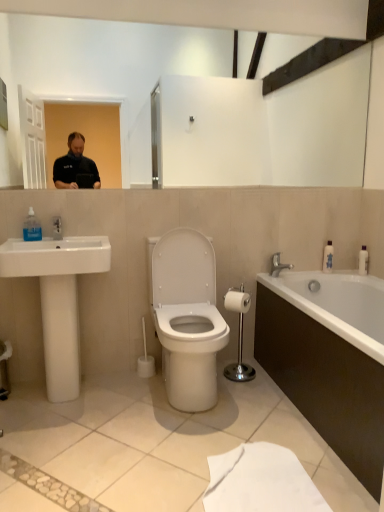
Image resolution: width=384 pixels, height=512 pixels. Find the location of `white glossy bathtub at lower right`. white glossy bathtub at lower right is located at coordinates (328, 362).

Image resolution: width=384 pixels, height=512 pixels. What do you see at coordinates (363, 260) in the screenshot? I see `white plastic bottle at right, the 2th toiletry in the left-to-right sequence` at bounding box center [363, 260].

How much space does white plastic bottle at right, arranged as the 1th toiletry when viewed from the right, occupy vertically?

white plastic bottle at right, arranged as the 1th toiletry when viewed from the right, is 7.76 inches tall.

This screenshot has height=512, width=384. I want to click on silver metallic faucet at right, so click(x=278, y=265).

Describe the element at coordinates (328, 257) in the screenshot. I see `white glossy bottle at right, the 1th toiletry in the left-to-right sequence` at that location.

This screenshot has height=512, width=384. I want to click on chrome metallic toilet paper holder at center, so click(238, 334).

Considering the relative sizes of white glossy bottle at right, the 1th toiletry in the left-to-right sequence, and white matte toilet paper at center-right in the image provided, is white glossy bottle at right, the 1th toiletry in the left-to-right sequence, wider than white matte toilet paper at center-right?

No, white glossy bottle at right, the 1th toiletry in the left-to-right sequence, is not wider than white matte toilet paper at center-right.

From a real-world perspective, is white glossy bottle at right, the 1th toiletry in the left-to-right sequence, below white matte toilet paper at center-right?

No.

Is silver metallic faucet at right facing away from white glossy bathtub at lower right?

No, silver metallic faucet at right's orientation is not away from white glossy bathtub at lower right.

Where is `tap behind the white glossy bathtub at lower right`? The image size is (384, 512). tap behind the white glossy bathtub at lower right is located at coordinates (x=278, y=265).

Is silver metallic faucet at right smaller than white glossy bathtub at lower right?

Correct, silver metallic faucet at right occupies less space than white glossy bathtub at lower right.

Is white matte toilet paper at center-right surrounded by white plastic toilet brush at center?

No, white matte toilet paper at center-right is not a part of white plastic toilet brush at center.

Considering the positions of points (143, 376) and (245, 294), is point (143, 376) closer to camera compared to point (245, 294)?

Yes, it is.

Could you tell me if white plastic toilet brush at center is turned towards white matte toilet paper at center-right?

No, white plastic toilet brush at center is not turned towards white matte toilet paper at center-right.

From a real-world perspective, is white plastic toilet brush at center over white matte toilet paper at center-right?

No.

Considering the relative positions of transparent plastic soap dispenser at left and white glossy bottle at right, arranged as the 2th toiletry when viewed from the right, in the image provided, is transparent plastic soap dispenser at left behind white glossy bottle at right, arranged as the 2th toiletry when viewed from the right,?

That is False.

In terms of size, does transparent plastic soap dispenser at left appear bigger or smaller than white glossy bottle at right, the 1th toiletry in the left-to-right sequence?

Considering their sizes, transparent plastic soap dispenser at left takes up more space than white glossy bottle at right, the 1th toiletry in the left-to-right sequence.

Looking at this image, is transparent plastic soap dispenser at left situated inside white glossy bottle at right, the 1th toiletry in the left-to-right sequence, or outside?

transparent plastic soap dispenser at left is located beyond the bounds of white glossy bottle at right, the 1th toiletry in the left-to-right sequence.

Find the location of a particular element. The image size is (384, 512). toiletry located below the white glossy bottle at right, arranged as the 2th toiletry when viewed from the right (from the image's perspective) is located at coordinates (363, 260).

Consider the image. From a real-world perspective, is white glossy bottle at right, the 1th toiletry in the left-to-right sequence, physically below white plastic bottle at right, the 2th toiletry in the left-to-right sequence?

No, from a real-world perspective, white glossy bottle at right, the 1th toiletry in the left-to-right sequence, is not under white plastic bottle at right, the 2th toiletry in the left-to-right sequence.

Between transparent plastic soap dispenser at left and white plastic toilet brush at center, which one appears on the right side from the viewer's perspective?

Positioned to the right is white plastic toilet brush at center.

Is transparent plastic soap dispenser at left oriented towards white plastic toilet brush at center?

No, transparent plastic soap dispenser at left is not facing towards white plastic toilet brush at center.

Is transparent plastic soap dispenser at left inside the boundaries of white plastic toilet brush at center, or outside?

transparent plastic soap dispenser at left exists outside the volume of white plastic toilet brush at center.

Locate an element on the screen. The height and width of the screenshot is (512, 384). soap dispenser above the white plastic toilet brush at center (from the image's perspective) is located at coordinates (32, 227).

Can you tell me how much white glossy bottle at right, the 1th toiletry in the left-to-right sequence, and white ceramic sink at left differ in facing direction?

Answer: There is a 0.0658-degree angle between the facing directions of white glossy bottle at right, the 1th toiletry in the left-to-right sequence, and white ceramic sink at left.

Does white glossy bottle at right, arranged as the 2th toiletry when viewed from the right, have a lesser height compared to white ceramic sink at left?

Yes, white glossy bottle at right, arranged as the 2th toiletry when viewed from the right, is shorter than white ceramic sink at left.

From the image's perspective, which is above, white glossy bottle at right, arranged as the 2th toiletry when viewed from the right, or white ceramic sink at left?

white glossy bottle at right, arranged as the 2th toiletry when viewed from the right, is shown above in the image.

Is white glossy bottle at right, arranged as the 2th toiletry when viewed from the right, directly adjacent to white ceramic sink at left?

No, white glossy bottle at right, arranged as the 2th toiletry when viewed from the right, is not next to white ceramic sink at left.

You are a GUI agent. You are given a task and a screenshot of the screen. Output one action in this format:
    pyautogui.click(x=<x>, y=<y>)
    Task: Click on the 1st toiletry to the right when counting from the white matte toilet paper at center-right
    This screenshot has width=384, height=512.
    Given the screenshot: What is the action you would take?
    pyautogui.click(x=328, y=257)

Locate an element on the screen. The width and height of the screenshot is (384, 512). tap located above the white glossy bathtub at lower right (from a real-world perspective) is located at coordinates (278, 265).

Considering their positions, is white plastic toilet brush at center positioned closer to white matte toilet paper at center-right than white glossy bathtub at lower right?

white glossy bathtub at lower right is positioned closer to the anchor white matte toilet paper at center-right.

Estimate the real-world distances between objects in this image. Which object is closer to white matte toilet paper at center-right, white glossy bathtub at lower right or white plastic bottle at right, arranged as the 1th toiletry when viewed from the right?

white glossy bathtub at lower right.

When comparing their distances from white plastic toilet brush at center, does white matte toilet paper at center-right or chrome metallic toilet paper holder at center seem further?

The object further to white plastic toilet brush at center is white matte toilet paper at center-right.

Considering their positions, is white matte toilet paper at center-right positioned further to white glossy bottle at right, the 1th toiletry in the left-to-right sequence, than silver metallic faucet at right?

Based on the image, white matte toilet paper at center-right appears to be further to white glossy bottle at right, the 1th toiletry in the left-to-right sequence.

Looking at the image, which one is located further to chrome metallic toilet paper holder at center, white glossy bottle at right, the 1th toiletry in the left-to-right sequence, or white ceramic sink at left?

white ceramic sink at left lies further to chrome metallic toilet paper holder at center than the other object.

Estimate the real-world distances between objects in this image. Which object is closer to white glossy bathtub at lower right, white ceramic sink at left or silver metallic faucet at right?

The object closer to white glossy bathtub at lower right is silver metallic faucet at right.

Based on their spatial positions, is white plastic bottle at right, the 2th toiletry in the left-to-right sequence, or chrome metallic toilet paper holder at center closer to white plastic toilet brush at center?

chrome metallic toilet paper holder at center is positioned closer to the anchor white plastic toilet brush at center.

Which object lies further to the anchor point white plastic toilet brush at center, chrome metallic toilet paper holder at center or white glossy bottle at right, the 1th toiletry in the left-to-right sequence?

white glossy bottle at right, the 1th toiletry in the left-to-right sequence.

At what (x,y) coordinates should I click in order to perform the action: click on bathtub located between white plastic toilet brush at center and white plastic bottle at right, the 2th toiletry in the left-to-right sequence, in the left-right direction. Please return your answer as a coordinate pair (x, y). This screenshot has height=512, width=384. Looking at the image, I should click on (328, 362).

In order to click on brush between white glossy bathtub at lower right and silver metallic faucet at right along the z-axis in this screenshot , I will do `click(145, 359)`.

Identify the location of tap between transparent plastic soap dispenser at left and white plastic bottle at right, the 2th toiletry in the left-to-right sequence, in the horizontal direction. This screenshot has height=512, width=384. (278, 265).

The width and height of the screenshot is (384, 512). In order to click on toilet paper between white ceramic sink at left and silver metallic faucet at right in this screenshot , I will do `click(237, 301)`.